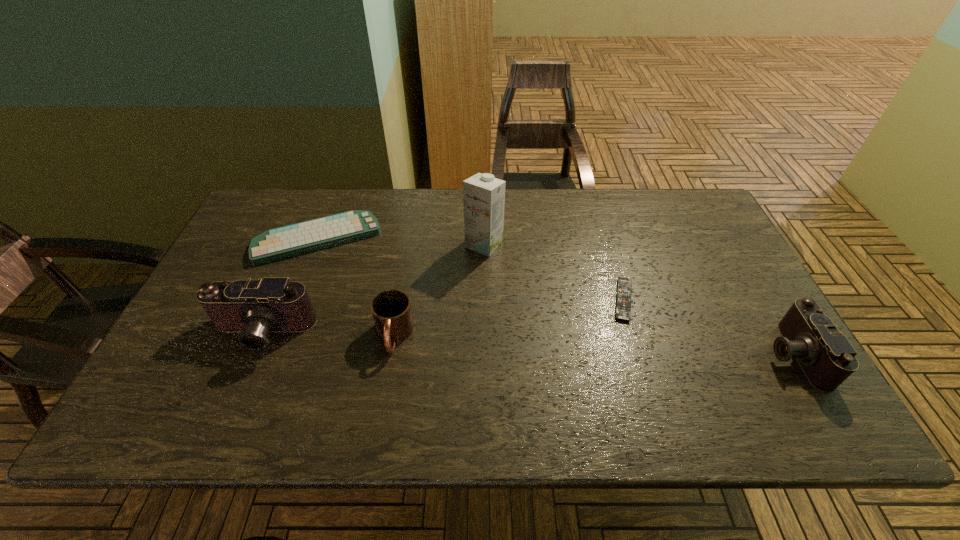
Please determine a free point for an extra camera to ensure balance. Please provide its 2D coordinates. Your answer should be formatted as a tuple, i.e. [(x, y)], where the tuple contains the x and y coordinates of a point satisfying the conditions above.

[(521, 343)]